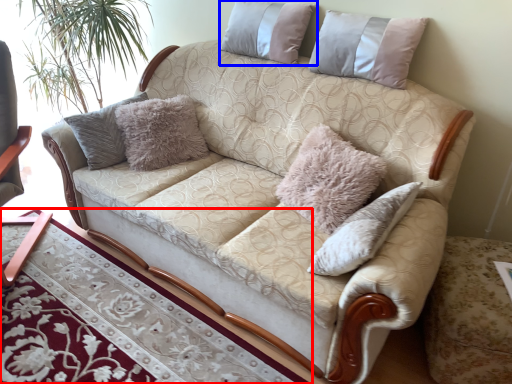
Question: Which of the following is the farthest to the observer, table (highlighted by a red box) or pillow (highlighted by a blue box)?

Choices:
 (A) table
 (B) pillow

Answer: (B)